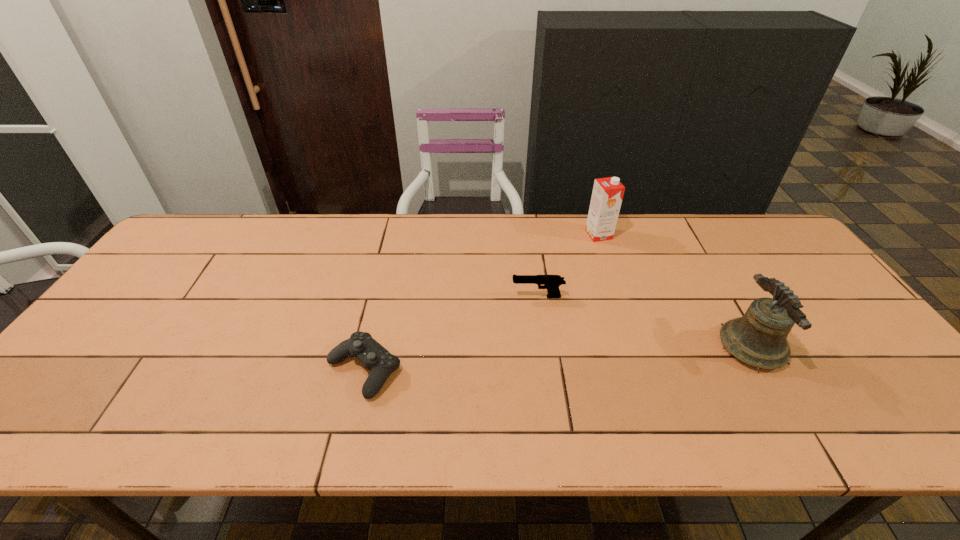
This screenshot has width=960, height=540. I want to click on the farthest object, so click(x=607, y=195).

Find the location of a particular element. The height and width of the screenshot is (540, 960). carton is located at coordinates (607, 195).

I want to click on bell, so click(759, 338).

At what (x,y) coordinates should I click in order to perform the action: click on pistol. Please return your answer as a coordinate pair (x, y). Looking at the image, I should click on (550, 282).

At what (x,y) coordinates should I click in order to perform the action: click on the third object from right to left. Please return your answer as a coordinate pair (x, y). This screenshot has height=540, width=960. Looking at the image, I should click on (550, 282).

This screenshot has width=960, height=540. Identify the location of the leftmost object. (381, 363).

The height and width of the screenshot is (540, 960). I want to click on the shortest object, so click(x=381, y=363).

What are the coordinates of `free space located on the front of the carton` in the screenshot? It's located at (617, 289).

Locate an element on the screen. vacant area situated 0.160m on the right of the bell is located at coordinates (850, 347).

Image resolution: width=960 pixels, height=540 pixels. What are the coordinates of `free space located on the front-facing side of the third tallest object` in the screenshot? It's located at (372, 296).